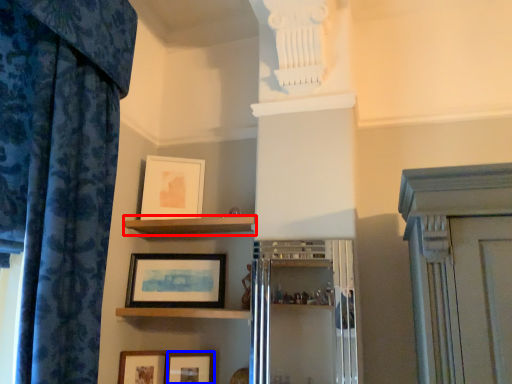
Question: Which object is closer to the camera taking this photo, shelf (highlighted by a red box) or picture frame (highlighted by a blue box)?

Choices:
 (A) shelf
 (B) picture frame

Answer: (A)